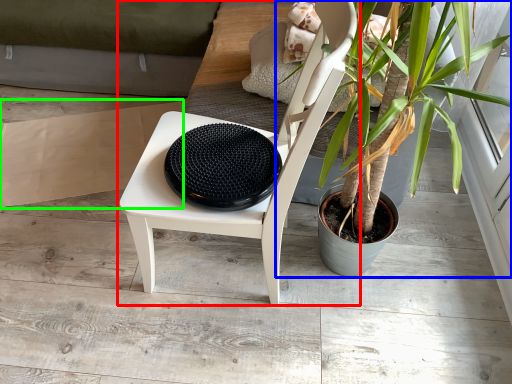
Question: Based on their relative distances, which object is farther from chair (highlighted by a red box)? Choose from houseplant (highlighted by a blue box) and cardboard (highlighted by a green box).

Choices:
 (A) houseplant
 (B) cardboard

Answer: (B)